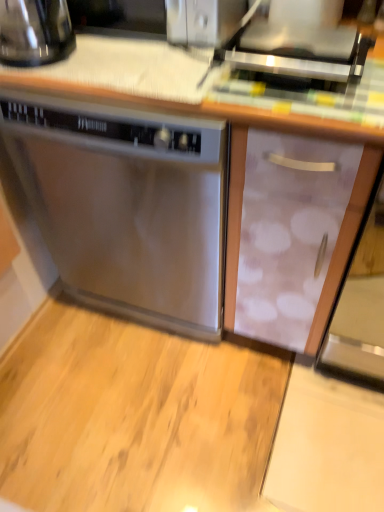
Question: From the image's perspective, relative to stainless steel dishwasher at center, is shiny black kettle at upper left above or below?

Choices:
 (A) below
 (B) above

Answer: (B)

Question: Is shiny black kettle at upper left wider or thinner than stainless steel dishwasher at center?

Choices:
 (A) wide
 (B) thin

Answer: (B)

Question: Which of these objects is positioned farthest from the stainless steel dishwasher at center?

Choices:
 (A) satin silver toaster at upper center
 (B) shiny black kettle at upper left

Answer: (A)

Question: Based on their relative distances, which object is nearer to the stainless steel dishwasher at center?

Choices:
 (A) satin silver toaster at upper center
 (B) shiny black kettle at upper left

Answer: (B)